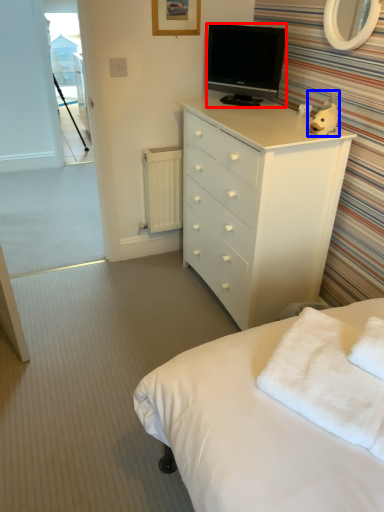
Question: Which object is closer to the camera taking this photo, television (highlighted by a red box) or toy (highlighted by a blue box)?

Choices:
 (A) television
 (B) toy

Answer: (B)